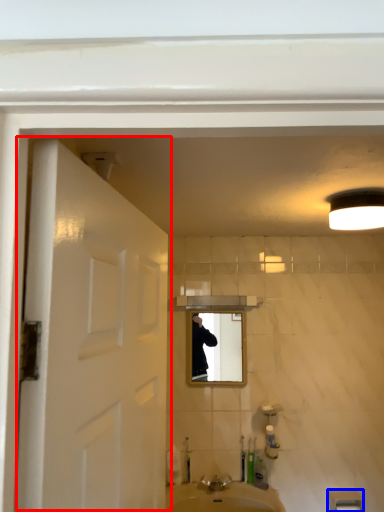
Question: Which object is further to the camera taking this photo, door (highlighted by a red box) or towel bar (highlighted by a blue box)?

Choices:
 (A) door
 (B) towel bar

Answer: (B)